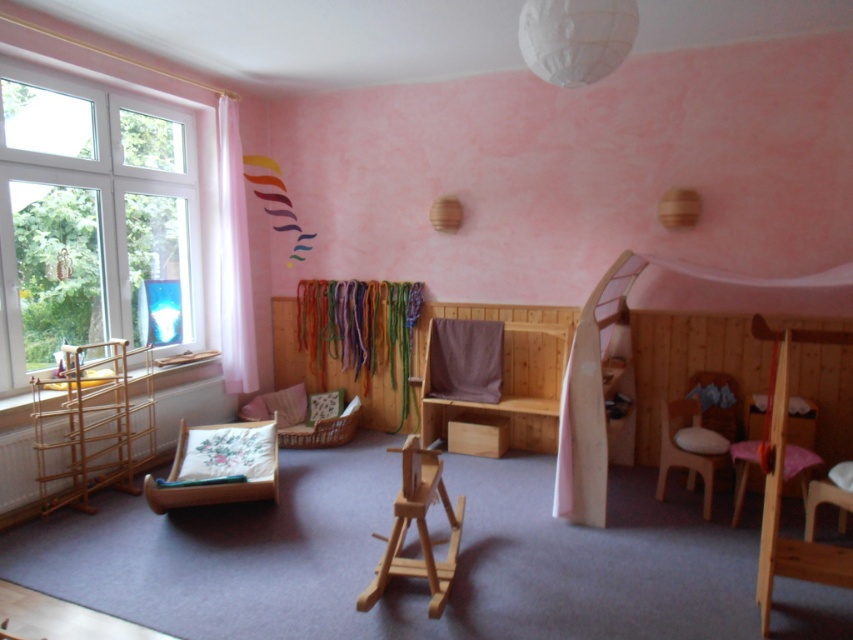
Question: Among these objects, which one is nearest to the camera?

Choices:
 (A) wooden armchair at center
 (B) white sheer curtain at left
 (C) wooden bunk bed at center
 (D) white plastic window at left

Answer: (A)

Question: Does wooden cushion at center appear over wooden armchair at center?

Choices:
 (A) yes
 (B) no

Answer: (B)

Question: Can you confirm if wooden cushion at center is thinner than wooden armchair at center?

Choices:
 (A) no
 (B) yes

Answer: (A)

Question: Does wooden bunk bed at center have a larger size compared to wooden cushion at center?

Choices:
 (A) yes
 (B) no

Answer: (A)

Question: Which object is positioned farthest from the wooden cushion at center?

Choices:
 (A) white sheer curtain at left
 (B) wooden bunk bed at center

Answer: (B)

Question: Which point is farther from the camera taking this photo?

Choices:
 (A) (570, 516)
 (B) (408, 467)
 (C) (227, 433)

Answer: (C)